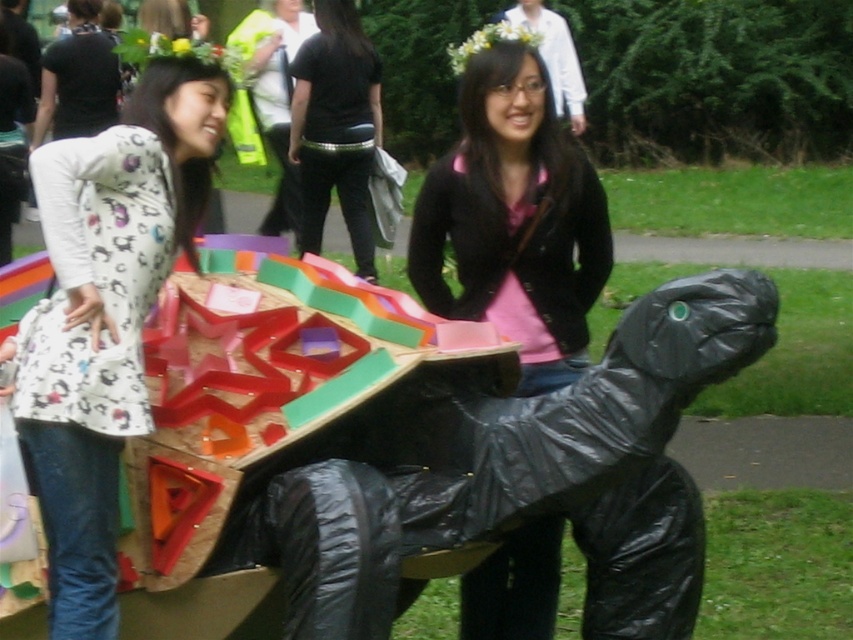
Between point (589, 163) and point (306, 38), which one is positioned behind?

Positioned behind is point (306, 38).

Can you confirm if matte black turtle at center is positioned below black leather pants at center?

Correct, matte black turtle at center is located below black leather pants at center.

I want to click on matte black turtle at center, so click(x=514, y=212).

Does white leopard print dress at left have a smaller size compared to black leather pants at center?

Yes.

Is white leopard print dress at left positioned at the back of black leather pants at center?

Answer: No, white leopard print dress at left is in front of black leather pants at center.

The width and height of the screenshot is (853, 640). What are the coordinates of `white leopard print dress at left` in the screenshot? It's located at (107, 308).

Between white leopard print dress at left and matte black turtle at center, which one has less height?

With less height is matte black turtle at center.

What are the coordinates of `white leopard print dress at left` in the screenshot? It's located at (107, 308).